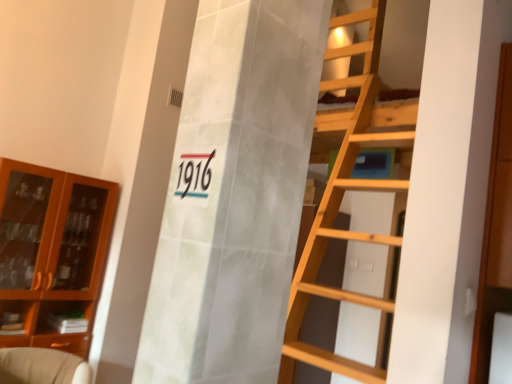
Measure the distance between point (91,227) and camera.

The depth of point (91,227) is 10.66 feet.

What is the approximate width of beige fabric armchair at lower left?

27.86 inches.

This screenshot has width=512, height=384. Describe the element at coordinates (41, 366) in the screenshot. I see `beige fabric armchair at lower left` at that location.

Locate an element on the screen. black glossy number at center is located at coordinates (194, 175).

Is brown glass cabinet at left, which appears as the 1th cabinetry when viewed from the back, inside beige fabric armchair at lower left?

No.

From a real-world perspective, is beige fabric armchair at lower left physically located above or below brown glass cabinet at left, arranged as the 2th cabinetry when viewed from the right?

beige fabric armchair at lower left is situated lower than brown glass cabinet at left, arranged as the 2th cabinetry when viewed from the right, in the real world.

The image size is (512, 384). I want to click on the 1st cabinetry directly above the beige fabric armchair at lower left (from a real-world perspective), so click(53, 249).

Is beige fabric armchair at lower left turned away from brown glass cabinet at left, arranged as the 2th cabinetry when viewed from the right?

Correct, beige fabric armchair at lower left is looking away from brown glass cabinet at left, arranged as the 2th cabinetry when viewed from the right.

Does wooden cabinet at right, which ranks as the 2th cabinetry in back-to-front order, contain brown glass cabinet at left, arranged as the 2th cabinetry when viewed from the right?

Actually, brown glass cabinet at left, arranged as the 2th cabinetry when viewed from the right, is outside wooden cabinet at right, which ranks as the 2th cabinetry in back-to-front order.

From the picture: Between wooden cabinet at right, which appears as the first cabinetry when viewed from the front, and brown glass cabinet at left, arranged as the 2th cabinetry when viewed from the right, which one appears on the left side from the viewer's perspective?

brown glass cabinet at left, arranged as the 2th cabinetry when viewed from the right.

Measure the distance between wooden cabinet at right, which is the first cabinetry in right-to-left order, and brown glass cabinet at left, arranged as the 2th cabinetry when viewed from the right.

They are 2.61 meters apart.

The height and width of the screenshot is (384, 512). In order to click on cabinetry below the wooden cabinet at right, which appears as the first cabinetry when viewed from the front (from a real-world perspective) in this screenshot , I will do `click(53, 249)`.

Can you confirm if brown glass cabinet at left, which appears as the second cabinetry when viewed from the front, is smaller than black glossy number at center?

Incorrect, brown glass cabinet at left, which appears as the second cabinetry when viewed from the front, is not smaller in size than black glossy number at center.

Is brown glass cabinet at left, arranged as the 2th cabinetry when viewed from the right, facing away from black glossy number at center?

No.

The height and width of the screenshot is (384, 512). Find the location of `number above the brown glass cabinet at left, arranged as the 2th cabinetry when viewed from the right (from a real-world perspective)`. number above the brown glass cabinet at left, arranged as the 2th cabinetry when viewed from the right (from a real-world perspective) is located at coordinates (194, 175).

Considering the relative positions of brown glass cabinet at left, which appears as the second cabinetry when viewed from the front, and black glossy number at center in the image provided, is brown glass cabinet at left, which appears as the second cabinetry when viewed from the front, to the right of black glossy number at center from the viewer's perspective?

No.

Consider the image. From a real-world perspective, which is physically below, wooden cabinet at right, arranged as the 2th cabinetry when viewed from the left, or beige fabric armchair at lower left?

beige fabric armchair at lower left is physically lower.

Is wooden cabinet at right, which ranks as the 2th cabinetry in back-to-front order, at the left side of beige fabric armchair at lower left?

Incorrect, wooden cabinet at right, which ranks as the 2th cabinetry in back-to-front order, is not on the left side of beige fabric armchair at lower left.

From the image's perspective, is wooden cabinet at right, which ranks as the 2th cabinetry in back-to-front order, on top of beige fabric armchair at lower left?

Yes.

Based on the photo, is wooden cabinet at right, arranged as the 2th cabinetry when viewed from the left, far away from beige fabric armchair at lower left?

wooden cabinet at right, arranged as the 2th cabinetry when viewed from the left, is far away from beige fabric armchair at lower left.

Is beige fabric armchair at lower left beside black glossy number at center?

beige fabric armchair at lower left and black glossy number at center are not in contact.

In terms of width, does beige fabric armchair at lower left look wider or thinner when compared to black glossy number at center?

Clearly, beige fabric armchair at lower left has more width compared to black glossy number at center.

Could you tell me if beige fabric armchair at lower left is facing black glossy number at center?

No, beige fabric armchair at lower left is not aimed at black glossy number at center.

In terms of size, does wooden cabinet at right, which appears as the first cabinetry when viewed from the front, appear bigger or smaller than black glossy number at center?

Clearly, wooden cabinet at right, which appears as the first cabinetry when viewed from the front, is larger in size than black glossy number at center.

In the scene shown: Does wooden cabinet at right, which is the first cabinetry in right-to-left order, lie behind black glossy number at center?

That is True.

Between wooden cabinet at right, which is the first cabinetry in right-to-left order, and black glossy number at center, which one has less height?

With less height is black glossy number at center.

Which is closer, (x=196, y=192) or (x=475, y=346)?

Point (x=196, y=192) appears to be closer to the viewer than point (x=475, y=346).

Where is `cabinetry on the right of the black glossy number at center`? Image resolution: width=512 pixels, height=384 pixels. cabinetry on the right of the black glossy number at center is located at coordinates (496, 228).

Would you say black glossy number at center is to the left or to the right of wooden cabinet at right, which appears as the first cabinetry when viewed from the front, in the picture?

black glossy number at center is positioned on wooden cabinet at right, which appears as the first cabinetry when viewed from the front,'s left side.

Between black glossy number at center and wooden cabinet at right, which is the first cabinetry in right-to-left order, which one is positioned in front?

Positioned in front is black glossy number at center.

In the image, there is a brown glass cabinet at left, arranged as the 2th cabinetry when viewed from the right. At what (x,y) coordinates should I click in order to perform the action: click on armchair below it (from a real-world perspective). Please return your answer as a coordinate pair (x, y). The width and height of the screenshot is (512, 384). Looking at the image, I should click on (41, 366).

You are a GUI agent. You are given a task and a screenshot of the screen. Output one action in this format:
    pyautogui.click(x=<x>, y=<y>)
    Task: Click on the cabinetry in front of the brown glass cabinet at left, which appears as the second cabinetry when viewed from the front
    The image size is (512, 384).
    Given the screenshot: What is the action you would take?
    pyautogui.click(x=496, y=228)

From the image, which object appears to be farther from wooden cabinet at right, which appears as the first cabinetry when viewed from the front, black glossy number at center or brown glass cabinet at left, which appears as the second cabinetry when viewed from the front?

brown glass cabinet at left, which appears as the second cabinetry when viewed from the front.

Estimate the real-world distances between objects in this image. Which object is further from wooden cabinet at right, which is the first cabinetry in right-to-left order, black glossy number at center or beige fabric armchair at lower left?

beige fabric armchair at lower left.

Which object lies further to the anchor point brown glass cabinet at left, arranged as the 2th cabinetry when viewed from the right, wooden cabinet at right, which is the first cabinetry in right-to-left order, or black glossy number at center?

black glossy number at center lies further to brown glass cabinet at left, arranged as the 2th cabinetry when viewed from the right, than the other object.

From the image, which object appears to be farther from beige fabric armchair at lower left, brown glass cabinet at left, which appears as the 1th cabinetry when viewed from the back, or black glossy number at center?

black glossy number at center lies further to beige fabric armchair at lower left than the other object.

Looking at the image, which one is located closer to beige fabric armchair at lower left, wooden cabinet at right, which ranks as the 2th cabinetry in back-to-front order, or brown glass cabinet at left, which appears as the 1th cabinetry when viewed from the back?

brown glass cabinet at left, which appears as the 1th cabinetry when viewed from the back, is positioned closer to the anchor beige fabric armchair at lower left.

Estimate the real-world distances between objects in this image. Which object is closer to brown glass cabinet at left, arranged as the 2th cabinetry when viewed from the right, black glossy number at center or beige fabric armchair at lower left?

beige fabric armchair at lower left lies closer to brown glass cabinet at left, arranged as the 2th cabinetry when viewed from the right, than the other object.

Looking at the image, which one is located closer to black glossy number at center, beige fabric armchair at lower left or wooden cabinet at right, which is the first cabinetry in right-to-left order?

wooden cabinet at right, which is the first cabinetry in right-to-left order, is positioned closer to the anchor black glossy number at center.

Which object lies nearer to the anchor point brown glass cabinet at left, which appears as the 1th cabinetry when viewed from the back, beige fabric armchair at lower left or black glossy number at center?

beige fabric armchair at lower left.

Identify the location of number between brown glass cabinet at left, arranged as the 2th cabinetry when viewed from the right, and wooden cabinet at right, arranged as the 2th cabinetry when viewed from the left, in the horizontal direction. (194, 175).

I want to click on armchair between brown glass cabinet at left, which appears as the 1th cabinetry when viewed from the back, and wooden cabinet at right, which is the first cabinetry in right-to-left order, so click(41, 366).

This screenshot has height=384, width=512. I want to click on armchair located between black glossy number at center and brown glass cabinet at left, positioned as the first cabinetry in left-to-right order, in the depth direction, so click(x=41, y=366).

Locate an element on the screen. number between beige fabric armchair at lower left and wooden cabinet at right, arranged as the 2th cabinetry when viewed from the left, from left to right is located at coordinates (194, 175).